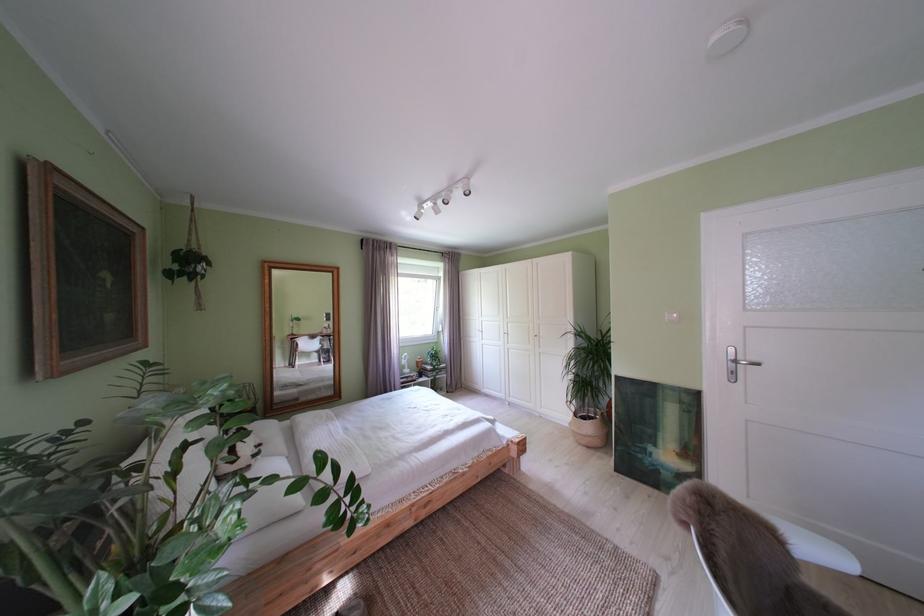
Image resolution: width=924 pixels, height=616 pixels. Describe the element at coordinates (439, 322) in the screenshot. I see `the white window handle` at that location.